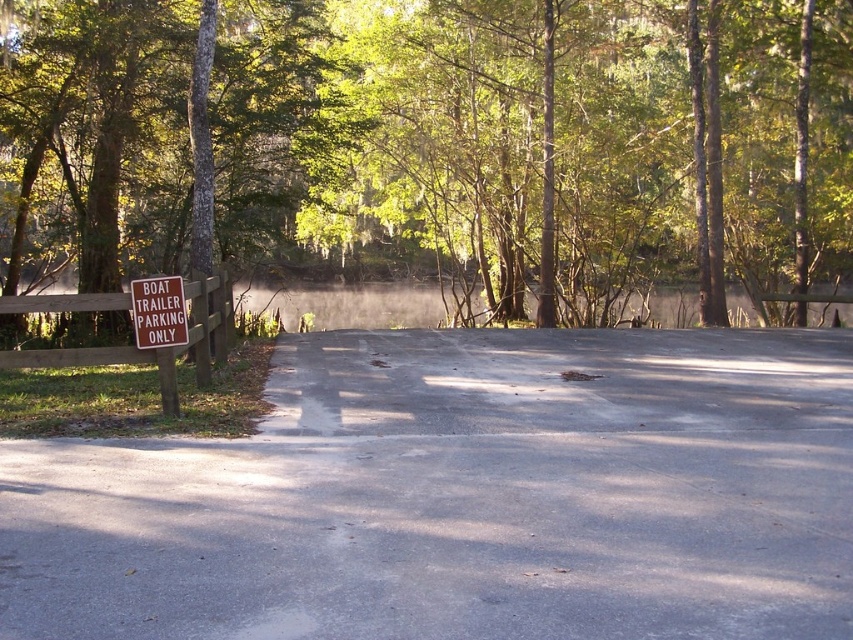
Question: Which point is closer to the camera?

Choices:
 (A) (648, 304)
 (B) (154, 332)
 (C) (828, 333)
 (D) (364, 20)

Answer: (B)

Question: Can you confirm if misty water at center is thinner than brown wooden sign at left?

Choices:
 (A) no
 (B) yes

Answer: (A)

Question: Where is gray asphalt road at center located in relation to misty water at center in the image?

Choices:
 (A) left
 (B) right

Answer: (B)

Question: Which point appears closest to the camera in this image?

Choices:
 (A) (173, 314)
 (B) (315, 291)
 (C) (38, 592)

Answer: (C)

Question: Which object is the closest to the misty water at center?

Choices:
 (A) brown wooden sign at left
 (B) gray asphalt road at center

Answer: (A)

Question: Is gray asphalt road at center in front of brown wooden sign at left?

Choices:
 (A) yes
 (B) no

Answer: (A)